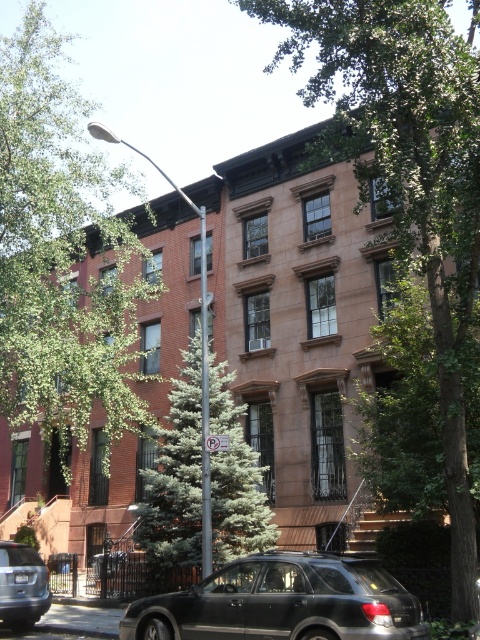
Question: Which point appears farthest from the camera in this image?

Choices:
 (A) (208, 387)
 (B) (338, 138)

Answer: (A)

Question: Is green leafy tree at upper center in front of green leafy tree at upper left?

Choices:
 (A) no
 (B) yes

Answer: (B)

Question: Does green textured evergreen tree at center have a greater width compared to matte silver sedan at lower left?

Choices:
 (A) yes
 (B) no

Answer: (A)

Question: Which point is closer to the camera?

Choices:
 (A) green leafy tree at upper center
 (B) green textured evergreen tree at center
 (C) matte silver sedan at lower left
 (D) green leafy tree at upper left

Answer: (A)

Question: Which of the following is the farthest from the observer?

Choices:
 (A) matte black suv at lower center
 (B) matte silver sedan at lower left
 (C) green leafy tree at upper left

Answer: (C)

Question: Is green leafy tree at upper center smaller than green leafy tree at upper left?

Choices:
 (A) no
 (B) yes

Answer: (B)